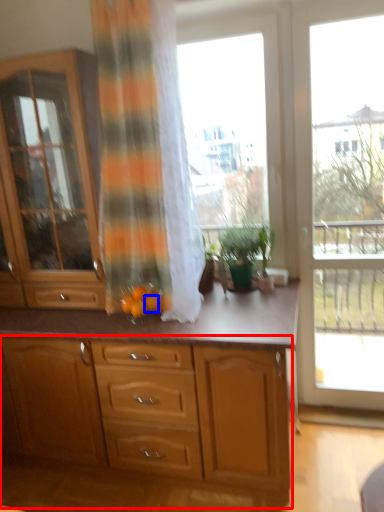
Question: Which object appears closest to the camera in this image, cabinetry (highlighted by a red box) or tangerine (highlighted by a blue box)?

Choices:
 (A) cabinetry
 (B) tangerine

Answer: (A)